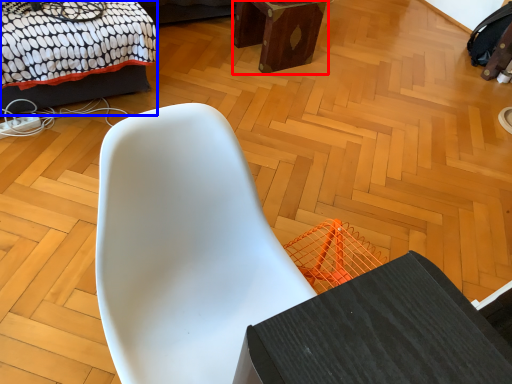
Question: Among these objects, which one is farthest to the camera, furniture (highlighted by a red box) or bed (highlighted by a blue box)?

Choices:
 (A) furniture
 (B) bed

Answer: (A)